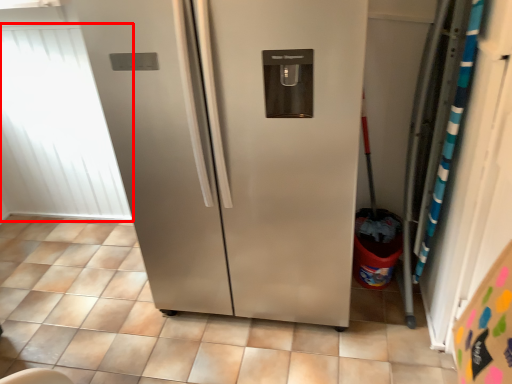
Question: From the image's perspective, what is the correct spatial relationship of window screen (annotated by the red box) in relation to tile?

Choices:
 (A) above
 (B) below

Answer: (A)